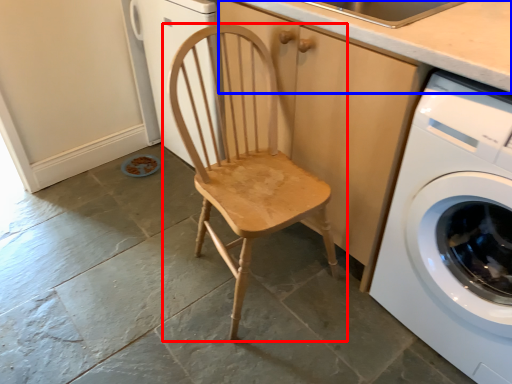
Question: Which object appears farthest to the camera in this image, chair (highlighted by a red box) or counter top (highlighted by a blue box)?

Choices:
 (A) chair
 (B) counter top

Answer: (B)